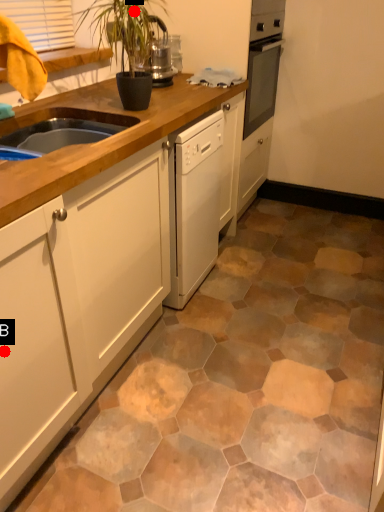
Question: Two points are circled on the image, labeled by A and B beside each circle. Which point appears closest to the camera in this image?

Choices:
 (A) A is closer
 (B) B is closer

Answer: (B)